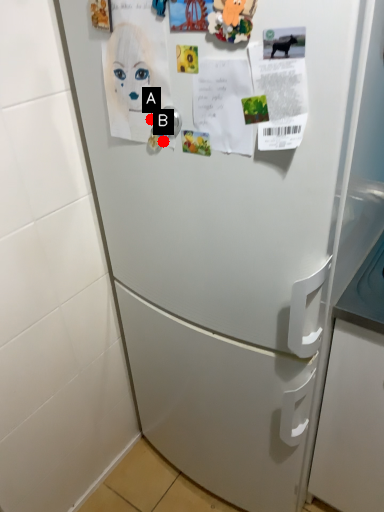
Question: Two points are circled on the image, labeled by A and B beside each circle. Which point is closer to the camera taking this photo?

Choices:
 (A) A is closer
 (B) B is closer

Answer: (A)